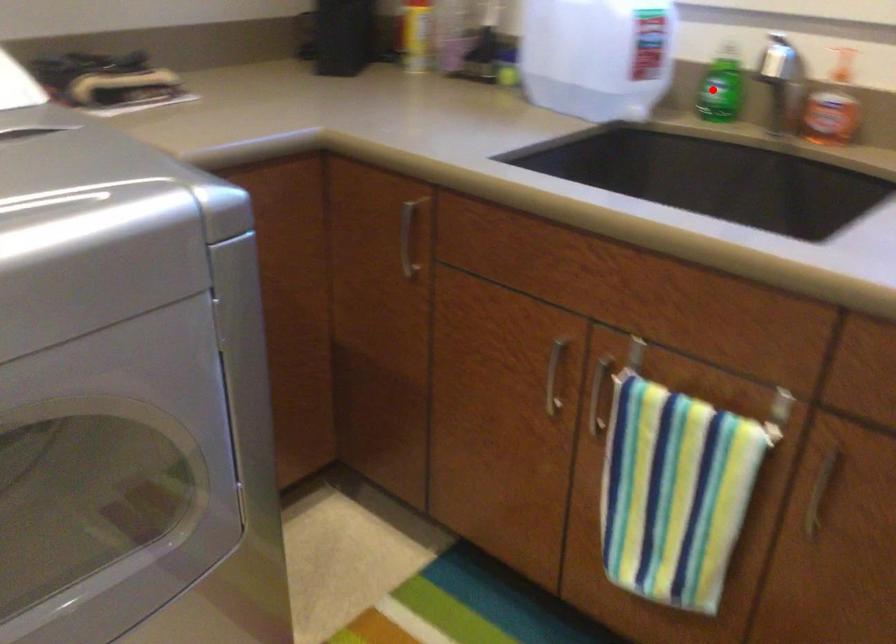
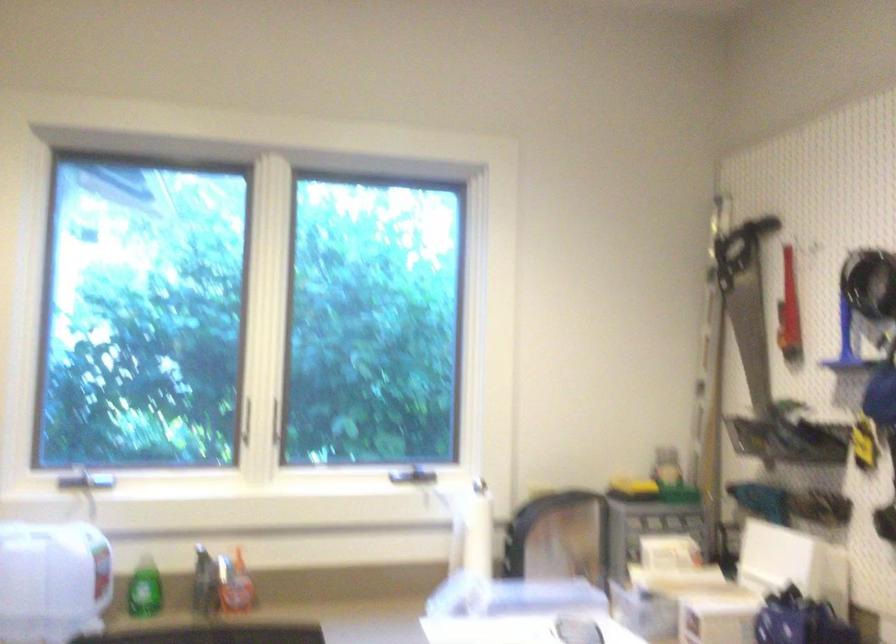
Question: A red point is marked in image1. In image2, is the corresponding 3D point closer to the camera or farther? Reply with the corresponding letter.

Choices:
 (A) The corresponding 3D point is closer.
 (B) The corresponding 3D point is farther.

Answer: (B)